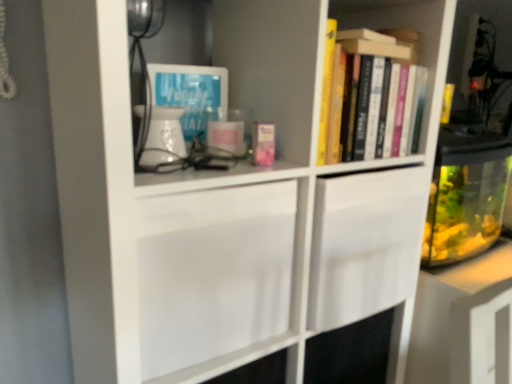
Describe the element at coordinates (347, 75) in the screenshot. I see `hardcover books at upper right, marked as the 2th book in a left-to-right arrangement` at that location.

The width and height of the screenshot is (512, 384). I want to click on blue paper at upper left, so 191,94.

Identify the location of hardcover books at upper right, the first book in the back-to-front sequence. (347, 75).

Based on the photo, from the image's perspective, is pink matte book at center, which is the second book from back to front, on hardcover books at upper right, the first book positioned from the right?

No, from the image's perspective, pink matte book at center, which is the second book from back to front, is not above hardcover books at upper right, the first book positioned from the right.

How far apart are pink matte book at center, the first book viewed from the front, and hardcover books at upper right, the first book positioned from the right?

8.06 inches.

In terms of height, does pink matte book at center, which is the second book from back to front, look taller or shorter compared to hardcover books at upper right, the first book positioned from the right?

Clearly, pink matte book at center, which is the second book from back to front, is shorter compared to hardcover books at upper right, the first book positioned from the right.

Based on the photo, can you confirm if pink matte book at center, the 2th book in the right-to-left sequence, is positioned to the right of hardcover books at upper right, the first book in the back-to-front sequence?

Incorrect, pink matte book at center, the 2th book in the right-to-left sequence, is not on the right side of hardcover books at upper right, the first book in the back-to-front sequence.

Looking at the image, does blue paper at upper left seem bigger or smaller compared to white plastic corded phone at upper left?

blue paper at upper left is bigger than white plastic corded phone at upper left.

From a real-world perspective, which object rests below the other?

blue paper at upper left, from a real-world perspective.

Locate an element on the screen. corded phone above the blue paper at upper left (from a real-world perspective) is located at coordinates (x=5, y=62).

Based on their positions, is blue paper at upper left located to the left or right of white plastic corded phone at upper left?

From the image, it's evident that blue paper at upper left is to the right of white plastic corded phone at upper left.

Looking at this image, can you confirm if pink matte book at center, which is counted as the 1th book, starting from the left, is wider than blue paper at upper left?

No.

In the scene shown: How many degrees apart are the facing directions of pink matte book at center, the first book viewed from the front, and blue paper at upper left?

The facing directions of pink matte book at center, the first book viewed from the front, and blue paper at upper left are 0.000703 degrees apart.

Is pink matte book at center, the first book viewed from the front, completely or partially outside of blue paper at upper left?

That's correct, pink matte book at center, the first book viewed from the front, is outside of blue paper at upper left.

From the image's perspective, relative to blue paper at upper left, is pink matte book at center, which is the second book from back to front, above or below?

From the image's perspective, pink matte book at center, which is the second book from back to front, appears below blue paper at upper left.

From a real-world perspective, relative to white plastic corded phone at upper left, is transparent glass fish tank at right vertically above or below?

In terms of real-world spatial position, transparent glass fish tank at right is below white plastic corded phone at upper left.

Looking at this image, considering the positions of objects transparent glass fish tank at right and white plastic corded phone at upper left in the image provided, who is more to the right, transparent glass fish tank at right or white plastic corded phone at upper left?

From the viewer's perspective, transparent glass fish tank at right appears more on the right side.

Considering the sizes of transparent glass fish tank at right and white plastic corded phone at upper left in the image, is transparent glass fish tank at right taller or shorter than white plastic corded phone at upper left?

Clearly, transparent glass fish tank at right is shorter compared to white plastic corded phone at upper left.

The height and width of the screenshot is (384, 512). I want to click on glass jar below the white plastic corded phone at upper left (from the image's perspective), so click(x=466, y=193).

Relative to blue paper at upper left, is white plastic corded phone at upper left in front or behind?

Clearly, white plastic corded phone at upper left is in front of blue paper at upper left.

Is point (5, 15) closer to camera compared to point (202, 80)?

Yes, it is.

Which is more to the right, white plastic corded phone at upper left or blue paper at upper left?

Positioned to the right is blue paper at upper left.

Are white plastic corded phone at upper left and blue paper at upper left located far from each other?

That's not correct — white plastic corded phone at upper left is a little close to blue paper at upper left.

Is point (340, 101) less distant than point (217, 84)?

Yes, it is in front of point (217, 84).

Identify the location of book above the blue paper at upper left (from a real-world perspective). (347, 75).

Does hardcover books at upper right, marked as the 2th book in a left-to-right arrangement, have a greater height compared to blue paper at upper left?

Yes.

What's the angular difference between hardcover books at upper right, the first book in the back-to-front sequence, and blue paper at upper left's facing directions?

The facing directions of hardcover books at upper right, the first book in the back-to-front sequence, and blue paper at upper left are 10.7 degrees apart.

Are blue paper at upper left and hardcover books at upper right, the first book in the back-to-front sequence, beside each other?

blue paper at upper left is not next to hardcover books at upper right, the first book in the back-to-front sequence, and they're not touching.

This screenshot has height=384, width=512. In order to click on book cover on the left of hardcover books at upper right, the first book in the back-to-front sequence in this screenshot , I will do `click(191, 94)`.

From the image's perspective, which is above, blue paper at upper left or hardcover books at upper right, which appears as the 2th book when viewed from the front?

blue paper at upper left.

Is blue paper at upper left surrounding hardcover books at upper right, which appears as the 2th book when viewed from the front?

Actually, hardcover books at upper right, which appears as the 2th book when viewed from the front, is outside blue paper at upper left.

Where is `book below the hardcover books at upper right, marked as the 2th book in a left-to-right arrangement (from a real-world perspective)`? The width and height of the screenshot is (512, 384). book below the hardcover books at upper right, marked as the 2th book in a left-to-right arrangement (from a real-world perspective) is located at coordinates [263, 143].

Find the location of a particular element. The height and width of the screenshot is (384, 512). corded phone in front of the blue paper at upper left is located at coordinates (5, 62).

When comparing their distances from blue paper at upper left, does hardcover books at upper right, the first book positioned from the right, or white plastic corded phone at upper left seem further?

Based on the image, white plastic corded phone at upper left appears to be further to blue paper at upper left.

Estimate the real-world distances between objects in this image. Which object is closer to pink matte book at center, which is the second book from back to front, blue paper at upper left or white plastic corded phone at upper left?

blue paper at upper left is positioned closer to the anchor pink matte book at center, which is the second book from back to front.

Estimate the real-world distances between objects in this image. Which object is further from blue paper at upper left, white plastic corded phone at upper left or transparent glass fish tank at right?

transparent glass fish tank at right is further to blue paper at upper left.

Looking at the image, which one is located closer to transparent glass fish tank at right, pink matte book at center, which is counted as the 1th book, starting from the left, or hardcover books at upper right, marked as the 2th book in a left-to-right arrangement?

The object closer to transparent glass fish tank at right is hardcover books at upper right, marked as the 2th book in a left-to-right arrangement.

Looking at the image, which one is located further to hardcover books at upper right, marked as the 2th book in a left-to-right arrangement, blue paper at upper left or white plastic corded phone at upper left?

Among the two, white plastic corded phone at upper left is located further to hardcover books at upper right, marked as the 2th book in a left-to-right arrangement.

Which object lies further to the anchor point hardcover books at upper right, the first book in the back-to-front sequence, transparent glass fish tank at right or pink matte book at center, which is counted as the 1th book, starting from the left?

transparent glass fish tank at right.

Based on their spatial positions, is blue paper at upper left or transparent glass fish tank at right further from white plastic corded phone at upper left?

transparent glass fish tank at right lies further to white plastic corded phone at upper left than the other object.

Looking at this image, estimate the real-world distances between objects in this image. Which object is closer to white plastic corded phone at upper left, transparent glass fish tank at right or blue paper at upper left?

blue paper at upper left is closer to white plastic corded phone at upper left.

You are a GUI agent. You are given a task and a screenshot of the screen. Output one action in this format:
    pyautogui.click(x=<x>, y=<y>)
    Task: Click on the book situated between white plastic corded phone at upper left and hardcover books at upper right, marked as the 2th book in a left-to-right arrangement, from left to right
    The width and height of the screenshot is (512, 384).
    Given the screenshot: What is the action you would take?
    click(x=263, y=143)

At what (x,y) coordinates should I click in order to perform the action: click on book between blue paper at upper left and hardcover books at upper right, the first book in the back-to-front sequence, from left to right. Please return your answer as a coordinate pair (x, y). Image resolution: width=512 pixels, height=384 pixels. Looking at the image, I should click on (263, 143).

Where is `book cover between white plastic corded phone at upper left and pink matte book at center, which is counted as the 1th book, starting from the left, from left to right`? This screenshot has height=384, width=512. book cover between white plastic corded phone at upper left and pink matte book at center, which is counted as the 1th book, starting from the left, from left to right is located at coordinates (191, 94).

Where is `book cover situated between white plastic corded phone at upper left and hardcover books at upper right, which appears as the 2th book when viewed from the front, from left to right`? Image resolution: width=512 pixels, height=384 pixels. book cover situated between white plastic corded phone at upper left and hardcover books at upper right, which appears as the 2th book when viewed from the front, from left to right is located at coordinates (191, 94).